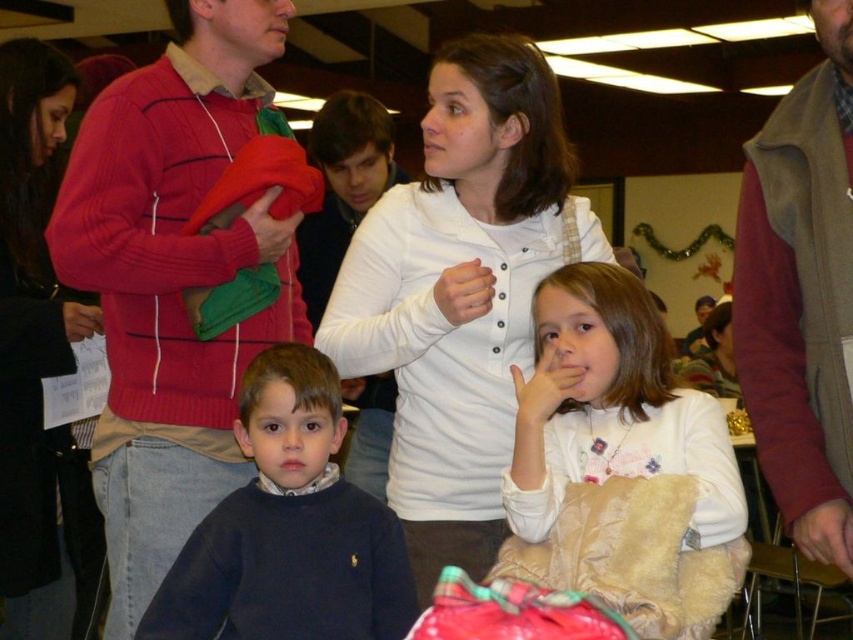
Can you confirm if velvet maroon vest at right is positioned to the right of white button-down shirt at center?

Correct, you'll find velvet maroon vest at right to the right of white button-down shirt at center.

Does velvet maroon vest at right have a greater width compared to white button-down shirt at center?

Correct, the width of velvet maroon vest at right exceeds that of white button-down shirt at center.

Who is more distant from viewer, (793, 385) or (471, 269)?

Positioned behind is point (471, 269).

Identify the location of velvet maroon vest at right. The width and height of the screenshot is (853, 640). (802, 296).

Does velvet maroon vest at right have a smaller size compared to dark blue sweater at center?

Correct, velvet maroon vest at right occupies less space than dark blue sweater at center.

Can you confirm if velvet maroon vest at right is positioned below dark blue sweater at center?

Incorrect, velvet maroon vest at right is not positioned below dark blue sweater at center.

Who is more distant from viewer, (830, 547) or (223, 596)?

Point (223, 596)

You are a GUI agent. You are given a task and a screenshot of the screen. Output one action in this format:
    pyautogui.click(x=<x>, y=<y>)
    Task: Click on the velvet maroon vest at right
    
    Given the screenshot: What is the action you would take?
    pyautogui.click(x=802, y=296)

Is white button-up shirt at center above white cotton shirt at center?

Incorrect, white button-up shirt at center is not positioned above white cotton shirt at center.

Measure the distance between white button-up shirt at center and white cotton shirt at center.

white button-up shirt at center is 37.50 inches from white cotton shirt at center.

Between point (463, 140) and point (387, 401), which one is positioned behind?

Positioned behind is point (387, 401).

Identify the location of white button-up shirt at center. (436, 280).